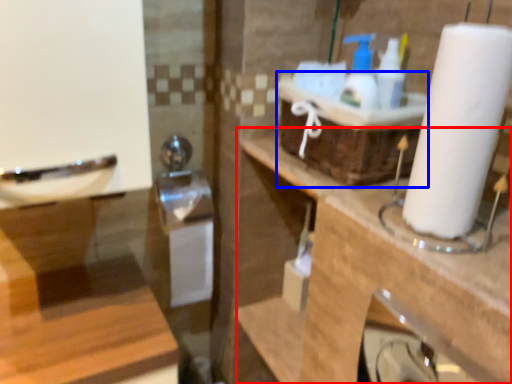
Question: Which of the following is the closest to the observer, counter top (highlighted by a red box) or basket (highlighted by a blue box)?

Choices:
 (A) counter top
 (B) basket

Answer: (A)